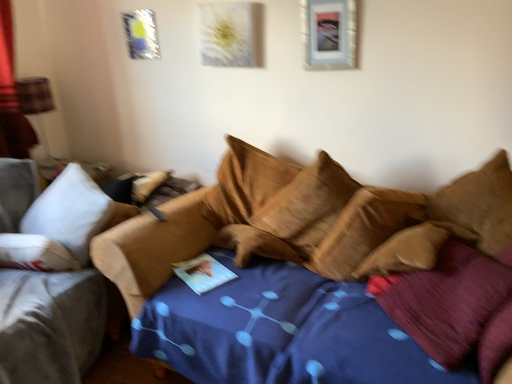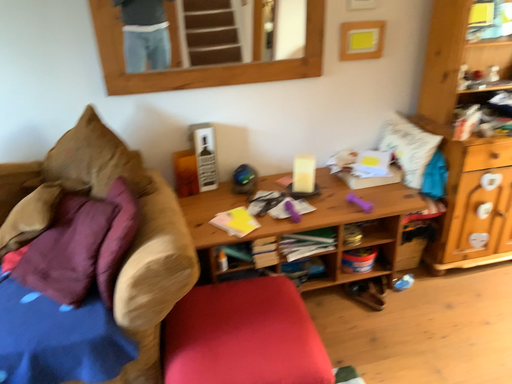
Question: Which way did the camera rotate in the video?

Choices:
 (A) rotated left
 (B) rotated right

Answer: (B)